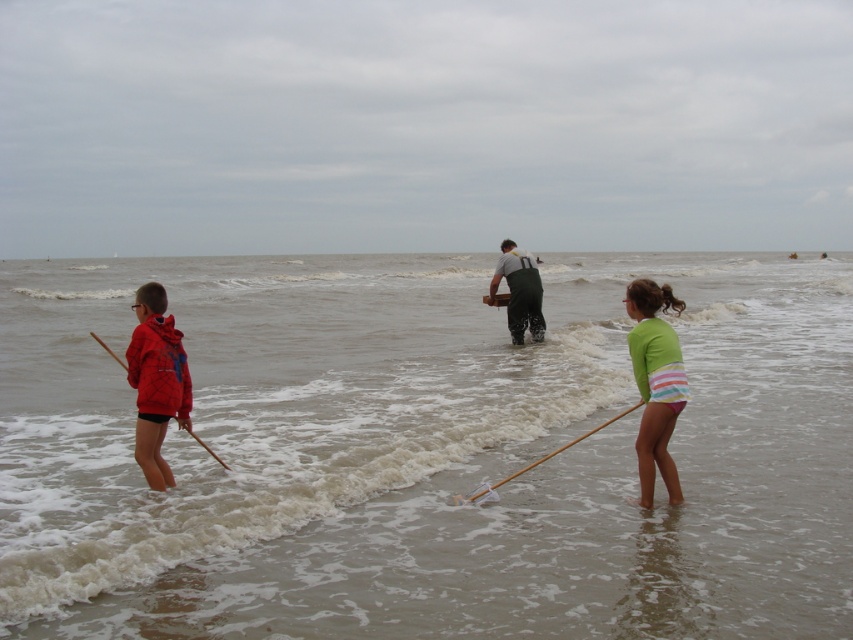
Question: Based on their relative distances, which object is farther from the green striped swimsuit at lower right?

Choices:
 (A) brown sandy water at center
 (B) green rubber boots at center
 (C) matte red hoodie at left

Answer: (A)

Question: Which object is positioned closest to the green striped swimsuit at lower right?

Choices:
 (A) brown sandy water at center
 (B) wooden stick at lower center

Answer: (B)

Question: Is green striped swimsuit at lower right positioned in front of wooden stick at left?

Choices:
 (A) yes
 (B) no

Answer: (A)

Question: Considering the relative positions of green striped swimsuit at lower right and wooden stick at left in the image provided, where is green striped swimsuit at lower right located with respect to wooden stick at left?

Choices:
 (A) below
 (B) above

Answer: (B)

Question: Based on their relative distances, which object is nearer to the green rubber boots at center?

Choices:
 (A) brown sandy water at center
 (B) matte red hoodie at left
 (C) wooden stick at left

Answer: (C)

Question: Can you confirm if brown sandy water at center is thinner than green striped swimsuit at lower right?

Choices:
 (A) no
 (B) yes

Answer: (A)